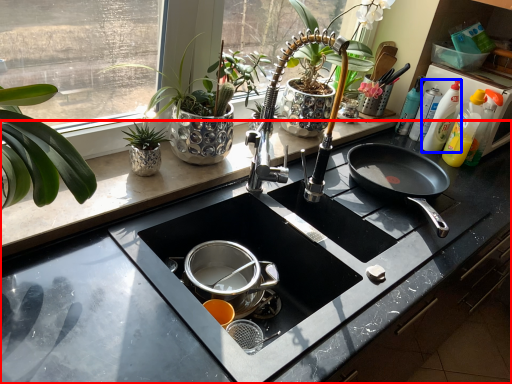
Question: Which of the following is the farthest to the observer, countertop (highlighted by a red box) or cleaning product (highlighted by a blue box)?

Choices:
 (A) countertop
 (B) cleaning product

Answer: (B)